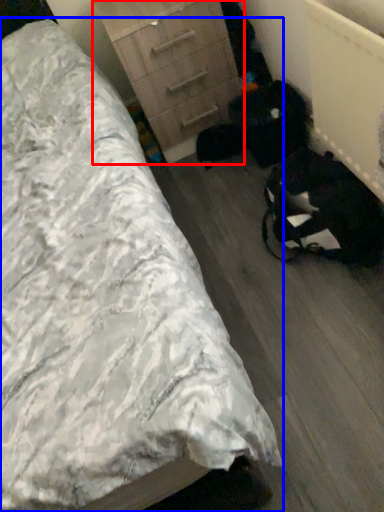
Question: Which of the following is the farthest to the observer, chest of drawers (highlighted by a red box) or bed (highlighted by a blue box)?

Choices:
 (A) chest of drawers
 (B) bed

Answer: (A)